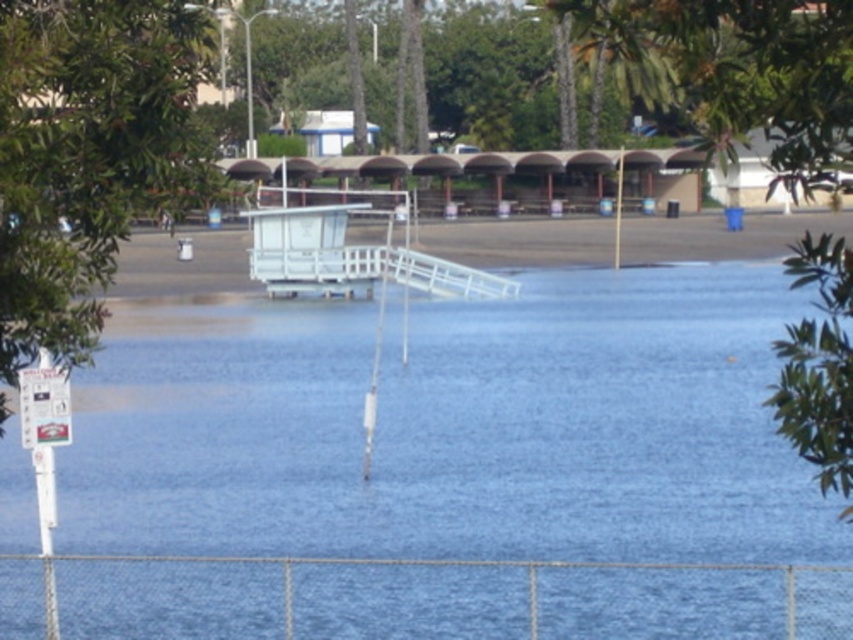
You are a swimmer who wants to reach the white plastic dock at center from the shore. The blue water at center is between you and the dock. Is the water level above or below the dock?

The blue water at center is below the white plastic dock at center, so the water level is below the dock.

You are standing at the point labeled point (453, 428). What is the terrain like at this location?

The point (453, 428) corresponds to blue water at center, so the terrain at this location is water.

You are a swimmer trying to reach the white plastic dock at center from the blue water at center. Which direction should you swim towards to reach the dock?

The blue water at center is thinner than the white plastic dock at center, so you should swim towards the thicker area to reach the white plastic dock at center.